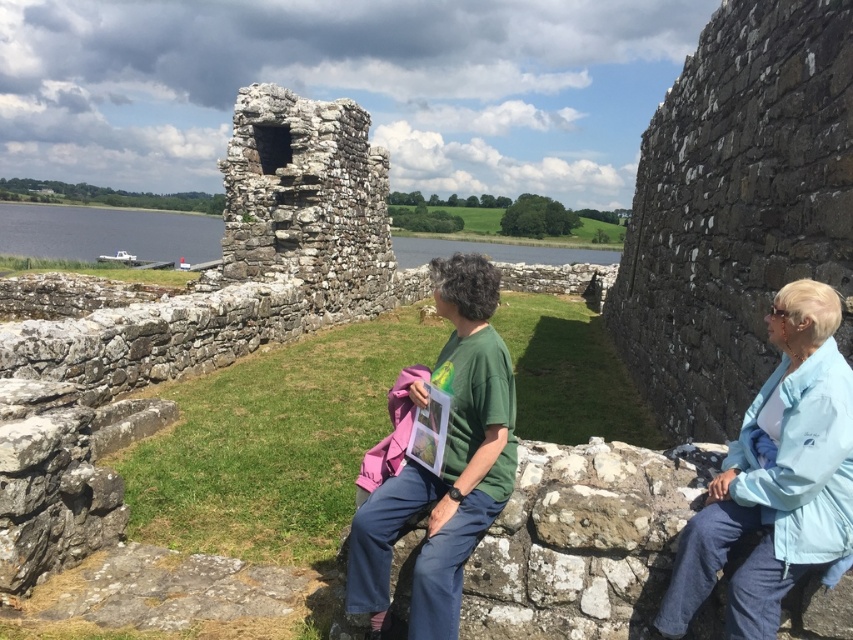
Does green matte shirt at center have a greater height compared to clear water at lower left?

In fact, green matte shirt at center may be shorter than clear water at lower left.

This screenshot has height=640, width=853. Describe the element at coordinates (444, 465) in the screenshot. I see `green matte shirt at center` at that location.

At what (x,y) coordinates should I click in order to perform the action: click on green matte shirt at center. Please return your answer as a coordinate pair (x, y). The height and width of the screenshot is (640, 853). Looking at the image, I should click on (444, 465).

Is light blue fabric at right positioned in front of green matte shirt at center?

That is True.

Is light blue fabric at right positioned at the back of green matte shirt at center?

No.

At what (x,y) coordinates should I click in order to perform the action: click on light blue fabric at right. Please return your answer as a coordinate pair (x, y). The width and height of the screenshot is (853, 640). Looking at the image, I should click on (776, 477).

Between green cotton shirt at center and clear water at lower left, which one is positioned lower?

green cotton shirt at center

Image resolution: width=853 pixels, height=640 pixels. Describe the element at coordinates (508, 500) in the screenshot. I see `green cotton shirt at center` at that location.

Between point (440, 285) and point (207, 218), which one is positioned behind?

The point (207, 218) is more distant.

This screenshot has height=640, width=853. Identify the location of green cotton shirt at center. (508, 500).